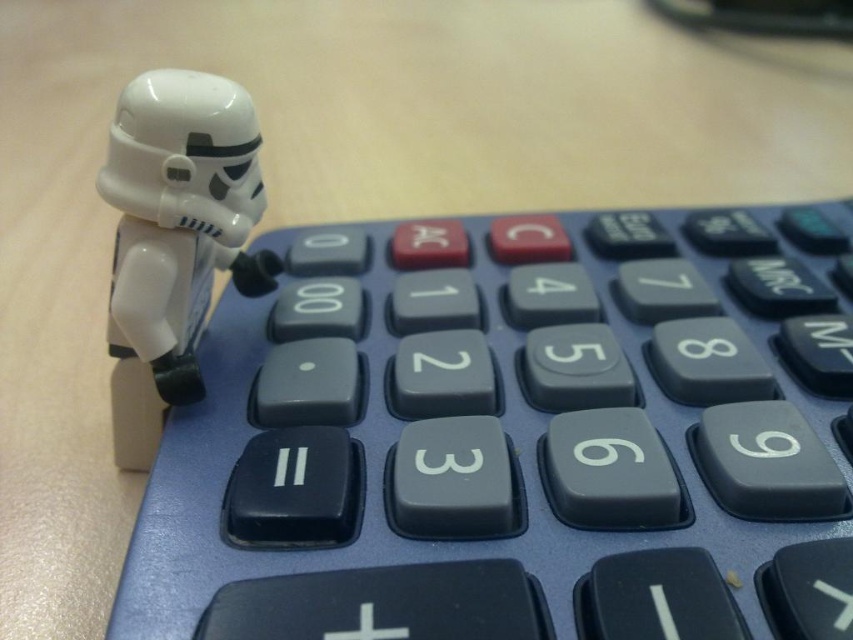
You are trying to determine if the blue plastic calculator at upper left can fit on a shelf that is only wide enough for the white glossy plastic stormtrooper at left. Based on their widths, which one is wider?

The blue plastic calculator at upper left might be wider than white glossy plastic stormtrooper at left, so it might not fit on the shelf designed for the stormtrooper.

You are trying to use the blue plastic calculator at upper left to solve a math problem, but the white glossy plastic stormtrooper at left is blocking it. Can you move the stormtrooper to access the calculator?

The blue plastic calculator at upper left is below the white glossy plastic stormtrooper at left, so moving the stormtrooper would allow access to the calculator.

You are a toy organizer trying to stack the blue plastic calculator at upper left and the white glossy plastic stormtrooper at left vertically. Based on their heights, which one should be placed at the bottom to ensure stability?

The blue plastic calculator at upper left has a lesser height compared to the white glossy plastic stormtrooper at left, so placing the taller stormtrooper at the bottom would provide a more stable base for the stack.